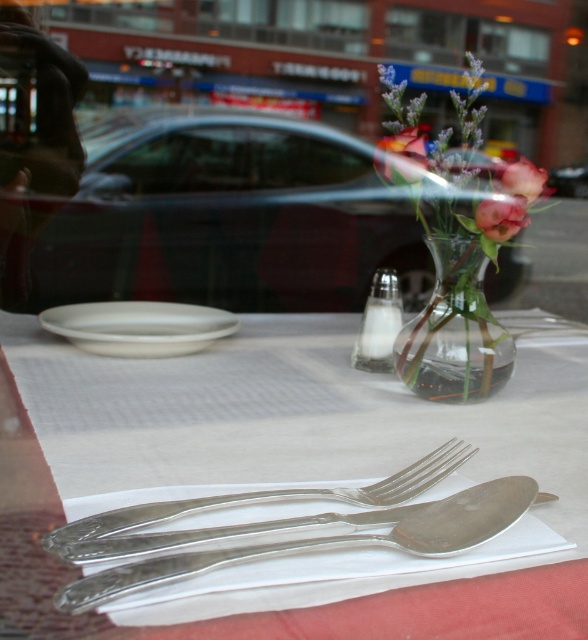
Does pink matte flower at center appear over pink matte flower at upper center?

Incorrect, pink matte flower at center is not positioned above pink matte flower at upper center.

Looking at this image, who is lower down, pink matte flower at center or pink matte flower at upper center?

Positioned lower is pink matte flower at center.

You are a GUI agent. You are given a task and a screenshot of the screen. Output one action in this format:
    pyautogui.click(x=<x>, y=<y>)
    Task: Click on the pink matte flower at center
    The height and width of the screenshot is (640, 588).
    Given the screenshot: What is the action you would take?
    pyautogui.click(x=502, y=218)

The width and height of the screenshot is (588, 640). I want to click on pink floral bouquet at center, so click(402, 156).

Between point (402, 168) and point (516, 184), which one is positioned in front?

Positioned in front is point (516, 184).

Where is `pink floral bouquet at center`? The height and width of the screenshot is (640, 588). pink floral bouquet at center is located at coordinates tap(402, 156).

At what (x,y) coordinates should I click in order to perform the action: click on polished silver spoon at center. Please return your answer as a coordinate pair (x, y). The height and width of the screenshot is (640, 588). Looking at the image, I should click on (306, 540).

Does polished silver spoon at center have a smaller size compared to pink floral bouquet at center?

Incorrect, polished silver spoon at center is not smaller in size than pink floral bouquet at center.

Which is in front, point (203, 536) or point (382, 141)?

Point (203, 536) is in front.

Identify the location of polished silver spoon at center. (306, 540).